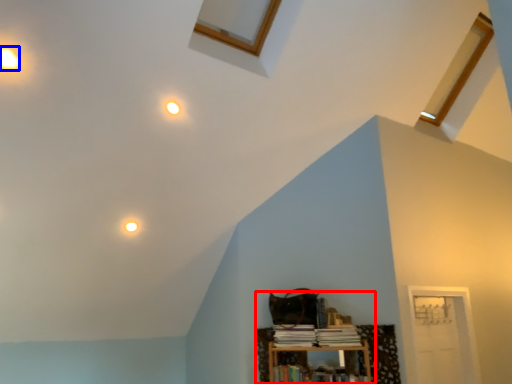
Question: Which point is closer to the camera, bookcase (highlighted by a red box) or dot (highlighted by a blue box)?

Choices:
 (A) bookcase
 (B) dot

Answer: (B)